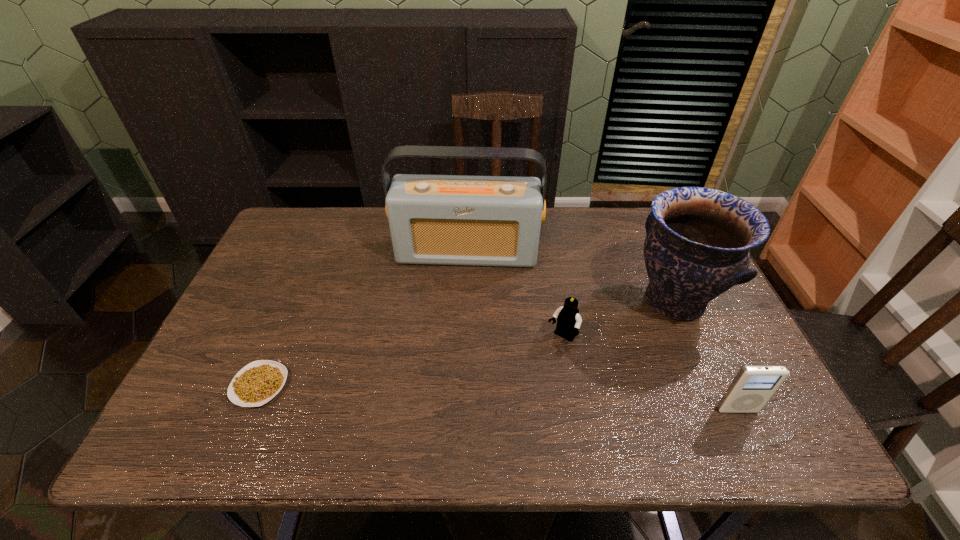
Identify the location of iPod that is at the right edge. This screenshot has height=540, width=960. click(752, 387).

Identify the location of pottery that is positioned at the right edge. (698, 240).

I want to click on object situated at the near left corner, so click(258, 382).

What are the coordinates of `object that is at the near right corner` in the screenshot? It's located at (752, 387).

The width and height of the screenshot is (960, 540). What are the coordinates of `free location at the far edge` in the screenshot? It's located at (616, 212).

At what (x,y) coordinates should I click in order to perform the action: click on free spot at the near edge of the desktop. Please return your answer as a coordinate pair (x, y). The image size is (960, 540). Looking at the image, I should click on (529, 408).

This screenshot has height=540, width=960. What are the coordinates of `vacant space at the left edge` in the screenshot? It's located at (268, 341).

Locate an element on the screen. The height and width of the screenshot is (540, 960). vacant space at the right edge is located at coordinates (721, 309).

This screenshot has width=960, height=540. What are the coordinates of `vacant space at the far left corner of the desktop` in the screenshot? It's located at (323, 216).

The width and height of the screenshot is (960, 540). What are the coordinates of `unoccupied area between the tallest object and the iPod` in the screenshot? It's located at (602, 331).